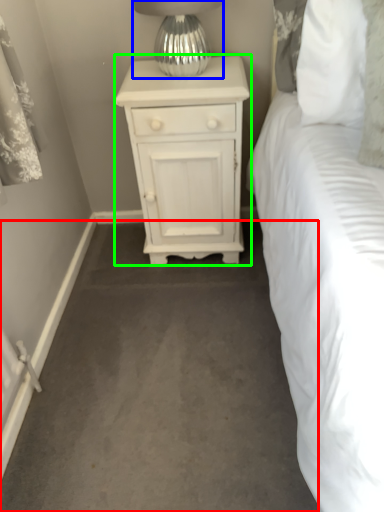
Question: Which is nearer to the concrete (highlighted by a red box)? table lamp (highlighted by a blue box) or nightstand (highlighted by a green box).

Choices:
 (A) table lamp
 (B) nightstand

Answer: (B)